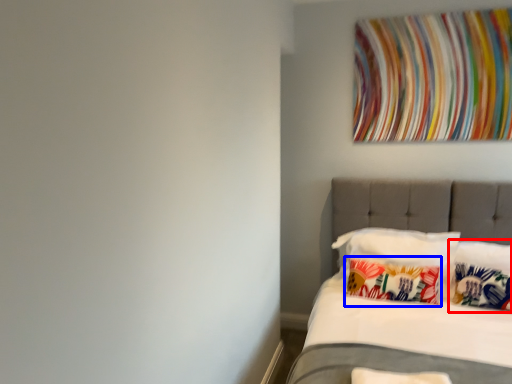
Question: Among these objects, which one is farthest to the camera, pillow (highlighted by a red box) or pillow (highlighted by a blue box)?

Choices:
 (A) pillow
 (B) pillow

Answer: (B)